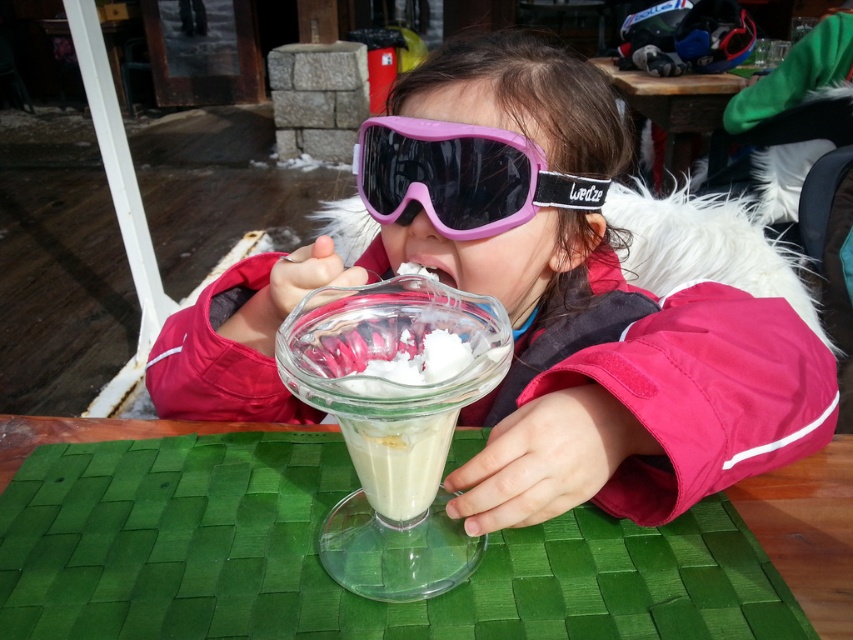
Question: Which is nearer to the pink matte/silicone goggles at center?

Choices:
 (A) pink matte goggles at center
 (B) green woven mat at center

Answer: (A)

Question: Which of the following is the closest to the observer?

Choices:
 (A) pyautogui.click(x=467, y=461)
 (B) pyautogui.click(x=807, y=600)
 (C) pyautogui.click(x=476, y=193)

Answer: (B)

Question: Which point appears closest to the camera in this image?

Choices:
 (A) (537, 205)
 (B) (401, 198)

Answer: (A)

Question: Considering the relative positions of green woven mat at center and pink matte/silicone goggles at center in the image provided, where is green woven mat at center located with respect to pink matte/silicone goggles at center?

Choices:
 (A) left
 (B) right

Answer: (A)

Question: Does pink matte goggles at center appear on the left side of green woven mat at center?

Choices:
 (A) yes
 (B) no

Answer: (B)

Question: Does pink matte goggles at center lie in front of green woven mat at center?

Choices:
 (A) no
 (B) yes

Answer: (B)